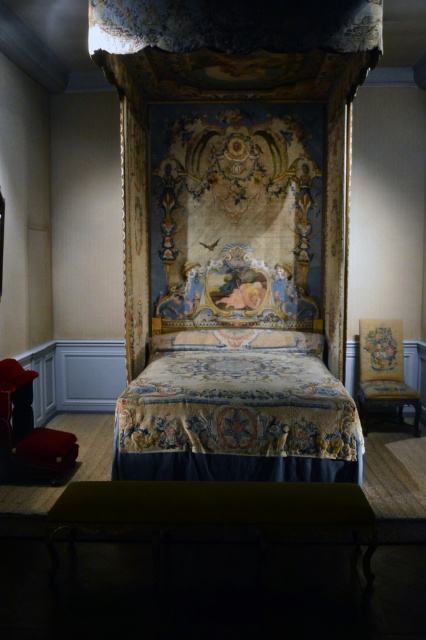
Can you confirm if gold fabric chair at right is thinner than silky cream pillow at center?

Correct, gold fabric chair at right's width is less than silky cream pillow at center's.

Which is below, gold fabric chair at right or silky cream pillow at center?

gold fabric chair at right

Between point (371, 324) and point (270, 349), which one is positioned behind?

The point (371, 324) is behind.

Where is `gold fabric chair at right`? The height and width of the screenshot is (640, 426). gold fabric chair at right is located at coordinates (383, 371).

Does embroidered fabric bed at center appear on the left side of gold fabric chair at right?

Yes, embroidered fabric bed at center is to the left of gold fabric chair at right.

Who is positioned more to the left, embroidered fabric bed at center or gold fabric chair at right?

Positioned to the left is embroidered fabric bed at center.

Is point (132, 403) positioned behind point (402, 340)?

No, it is in front of (402, 340).

The height and width of the screenshot is (640, 426). In order to click on embroidered fabric bed at center in this screenshot , I will do `click(236, 387)`.

Which is above, silky blue curtain at center or gold fabric chair at right?

silky blue curtain at center

Which is more to the right, silky blue curtain at center or gold fabric chair at right?

gold fabric chair at right

Is point (143, 193) farther from camera compared to point (363, 362)?

That is False.

At what (x,y) coordinates should I click in order to perform the action: click on silky blue curtain at center. Please return your answer as a coordinate pair (x, y). Image resolution: width=426 pixels, height=640 pixels. Looking at the image, I should click on (x=135, y=236).